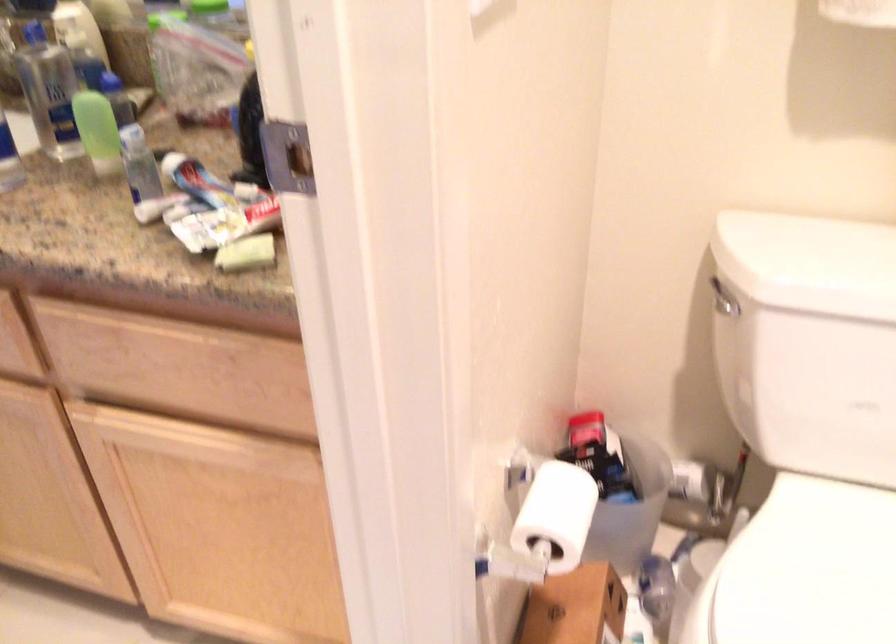
Identify the location of toilet tank lid. The height and width of the screenshot is (644, 896). (810, 263).